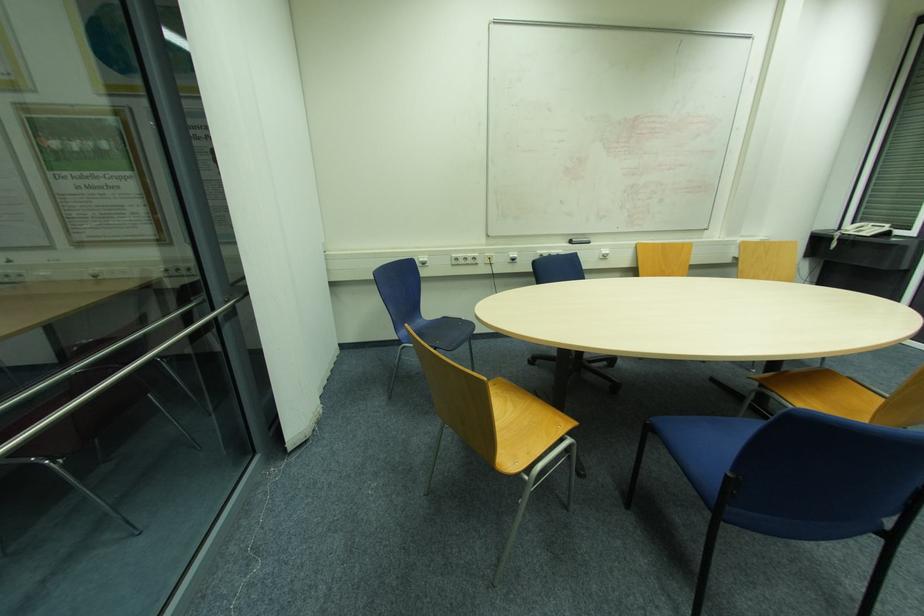
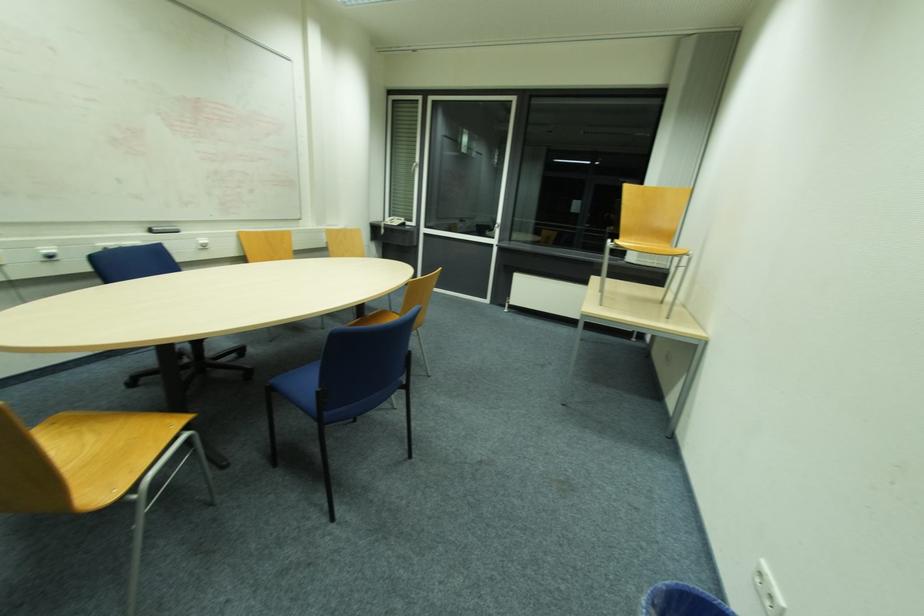
In the second image, find the point that corresponds to point (570, 238) in the first image.

(151, 227)